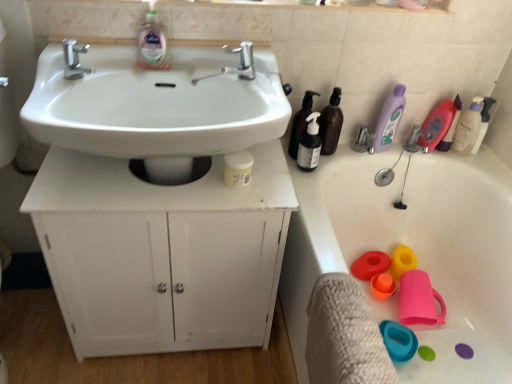
Question: From a real-world perspective, is white matte cabinet at center physically above white matte jar at center, arranged as the first toiletry when viewed from the front?

Choices:
 (A) yes
 (B) no

Answer: (B)

Question: Are white matte cabinet at center and white matte jar at center, arranged as the first toiletry when viewed from the front, located far from each other?

Choices:
 (A) yes
 (B) no

Answer: (B)

Question: Is white matte cabinet at center outside white matte jar at center, arranged as the 2th toiletry when viewed from the right?

Choices:
 (A) yes
 (B) no

Answer: (A)

Question: Is white matte cabinet at center looking in the opposite direction of white matte jar at center, which ranks as the second toiletry in back-to-front order?

Choices:
 (A) yes
 (B) no

Answer: (B)

Question: From the image's perspective, would you say white matte cabinet at center is positioned over white matte jar at center, which is counted as the 2th toiletry, starting from the top?

Choices:
 (A) no
 (B) yes

Answer: (A)

Question: Considering the positions of translucent plastic spray bottle at upper right, which is counted as the second cleaning product, starting from the right, and polished chrome tap at upper center, which ranks as the 1th tap in right-to-left order, in the image, is translucent plastic spray bottle at upper right, which is counted as the second cleaning product, starting from the right, wider or thinner than polished chrome tap at upper center, which ranks as the 1th tap in right-to-left order,?

Choices:
 (A) wide
 (B) thin

Answer: (B)

Question: In terms of size, does translucent plastic spray bottle at upper right, which is counted as the second cleaning product, starting from the right, appear bigger or smaller than polished chrome tap at upper center, which appears as the 2th tap when viewed from the left?

Choices:
 (A) small
 (B) big

Answer: (B)

Question: Is translucent plastic spray bottle at upper right, the fourth cleaning product when ordered from left to right, taller or shorter than polished chrome tap at upper center, which appears as the 2th tap when viewed from the left?

Choices:
 (A) tall
 (B) short

Answer: (A)

Question: From the image's perspective, relative to polished chrome tap at upper center, which ranks as the 1th tap in right-to-left order, is translucent plastic spray bottle at upper right, the fourth cleaning product when ordered from left to right, above or below?

Choices:
 (A) below
 (B) above

Answer: (A)

Question: Is point (381, 266) positioned closer to the camera than point (217, 286)?

Choices:
 (A) closer
 (B) farther

Answer: (B)

Question: From their relative heights in the image, would you say matte red plastic toy at lower right, which is the 3th toy from front to back, is taller or shorter than white matte cabinet at center?

Choices:
 (A) tall
 (B) short

Answer: (B)

Question: Is matte red plastic toy at lower right, which is the 3th toy from front to back, bigger or smaller than white matte cabinet at center?

Choices:
 (A) big
 (B) small

Answer: (B)

Question: From a real-world perspective, is matte red plastic toy at lower right, the second toy from the back, above or below white matte cabinet at center?

Choices:
 (A) above
 (B) below

Answer: (B)

Question: Do you think pink rubber cup at lower right, arranged as the 1th toy when viewed from the back, is within white glossy sink at center, or outside of it?

Choices:
 (A) inside
 (B) outside

Answer: (B)

Question: From the image's perspective, relative to white glossy sink at center, is pink rubber cup at lower right, arranged as the 1th toy when viewed from the back, above or below?

Choices:
 (A) below
 (B) above

Answer: (A)